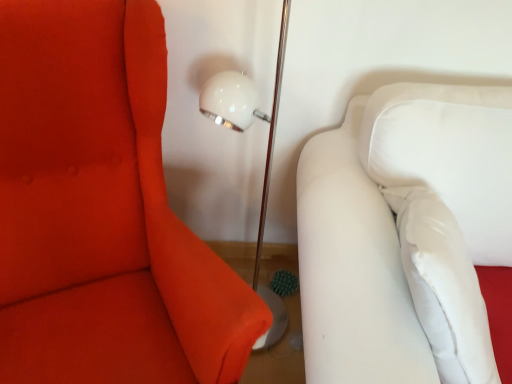
Image resolution: width=512 pixels, height=384 pixels. I want to click on matte white sofa at right, arranged as the second furniture when viewed from the right, so tap(102, 211).

Describe the element at coordinates (102, 211) in the screenshot. I see `matte white sofa at right, arranged as the second furniture when viewed from the right` at that location.

Where is `white fabric couch at right, the first furniture viewed from the right`? This screenshot has width=512, height=384. white fabric couch at right, the first furniture viewed from the right is located at coordinates pos(405,235).

This screenshot has width=512, height=384. Describe the element at coordinates (405, 235) in the screenshot. I see `white fabric couch at right, marked as the second furniture in a left-to-right arrangement` at that location.

Measure the distance between white fabric couch at right, marked as the second furniture in a left-to-right arrangement, and camera.

The depth of white fabric couch at right, marked as the second furniture in a left-to-right arrangement, is 28.08 inches.

At what (x,y) coordinates should I click in order to perform the action: click on matte white sofa at right, positioned as the first furniture in left-to-right order. Please return your answer as a coordinate pair (x, y). The image size is (512, 384). Looking at the image, I should click on (102, 211).

Is matte white sofa at right, positioned as the first furniture in left-to-right order, to the right of white fabric couch at right, marked as the second furniture in a left-to-right arrangement, from the viewer's perspective?

Incorrect, matte white sofa at right, positioned as the first furniture in left-to-right order, is not on the right side of white fabric couch at right, marked as the second furniture in a left-to-right arrangement.

Which object is more forward, matte white sofa at right, arranged as the second furniture when viewed from the right, or white fabric couch at right, the first furniture viewed from the right?

Positioned in front is matte white sofa at right, arranged as the second furniture when viewed from the right.

Which point is more forward, (184, 238) or (338, 185)?

The point (184, 238) is closer.

From the image's perspective, which one is positioned higher, matte white sofa at right, arranged as the second furniture when viewed from the right, or white fabric couch at right, marked as the second furniture in a left-to-right arrangement?

matte white sofa at right, arranged as the second furniture when viewed from the right.

Based on the photo, from a real-world perspective, is matte white sofa at right, positioned as the first furniture in left-to-right order, above or below white fabric couch at right, the first furniture viewed from the right?

In terms of real-world spatial position, matte white sofa at right, positioned as the first furniture in left-to-right order, is above white fabric couch at right, the first furniture viewed from the right.

Does matte white sofa at right, arranged as the second furniture when viewed from the right, have a lesser width compared to white fabric couch at right, the first furniture viewed from the right?

No, matte white sofa at right, arranged as the second furniture when viewed from the right, is not thinner than white fabric couch at right, the first furniture viewed from the right.

Who is shorter, matte white sofa at right, positioned as the first furniture in left-to-right order, or white fabric couch at right, the first furniture viewed from the right?

white fabric couch at right, the first furniture viewed from the right, is shorter.

Looking at the image, does matte white sofa at right, arranged as the second furniture when viewed from the right, seem bigger or smaller compared to white fabric couch at right, the first furniture viewed from the right?

matte white sofa at right, arranged as the second furniture when viewed from the right, is smaller than white fabric couch at right, the first furniture viewed from the right.

Is matte white sofa at right, positioned as the first furniture in left-to-right order, surrounding white fabric couch at right, marked as the second furniture in a left-to-right arrangement?

No, white fabric couch at right, marked as the second furniture in a left-to-right arrangement, is not inside matte white sofa at right, positioned as the first furniture in left-to-right order.

Are matte white sofa at right, positioned as the first furniture in left-to-right order, and white fabric couch at right, the first furniture viewed from the right, making contact?

They are not placed beside each other.

Is matte white sofa at right, arranged as the second furniture when viewed from the right, facing towards white fabric couch at right, marked as the second furniture in a left-to-right arrangement?

No, matte white sofa at right, arranged as the second furniture when viewed from the right, is not aimed at white fabric couch at right, marked as the second furniture in a left-to-right arrangement.

This screenshot has height=384, width=512. Find the location of `furniture located above the white fabric couch at right, the first furniture viewed from the right (from a real-world perspective)`. furniture located above the white fabric couch at right, the first furniture viewed from the right (from a real-world perspective) is located at coordinates (102, 211).

Is white fabric couch at right, marked as the second furniture in a left-to-right arrangement, to the right of matte white sofa at right, arranged as the second furniture when viewed from the right, from the viewer's perspective?

Indeed, white fabric couch at right, marked as the second furniture in a left-to-right arrangement, is positioned on the right side of matte white sofa at right, arranged as the second furniture when viewed from the right.

Which is behind, white fabric couch at right, marked as the second furniture in a left-to-right arrangement, or matte white sofa at right, arranged as the second furniture when viewed from the right?

white fabric couch at right, marked as the second furniture in a left-to-right arrangement, is more distant.

Does point (362, 258) lie in front of point (104, 216)?

That is True.

From the image's perspective, is white fabric couch at right, marked as the second furniture in a left-to-right arrangement, over matte white sofa at right, positioned as the first furniture in left-to-right order?

Incorrect, from the image's perspective, white fabric couch at right, marked as the second furniture in a left-to-right arrangement, is lower than matte white sofa at right, positioned as the first furniture in left-to-right order.

Consider the image. From a real-world perspective, between white fabric couch at right, the first furniture viewed from the right, and matte white sofa at right, arranged as the second furniture when viewed from the right, who is vertically higher?

From a 3D spatial view, matte white sofa at right, arranged as the second furniture when viewed from the right, is above.

Can you confirm if white fabric couch at right, the first furniture viewed from the right, is thinner than matte white sofa at right, positioned as the first furniture in left-to-right order?

Indeed, white fabric couch at right, the first furniture viewed from the right, has a lesser width compared to matte white sofa at right, positioned as the first furniture in left-to-right order.

Can you confirm if white fabric couch at right, marked as the second furniture in a left-to-right arrangement, is shorter than matte white sofa at right, positioned as the first furniture in left-to-right order?

Yes.

Considering the relative sizes of white fabric couch at right, marked as the second furniture in a left-to-right arrangement, and matte white sofa at right, arranged as the second furniture when viewed from the right, in the image provided, is white fabric couch at right, marked as the second furniture in a left-to-right arrangement, smaller than matte white sofa at right, arranged as the second furniture when viewed from the right,?

No.

Can matte white sofa at right, arranged as the second furniture when viewed from the right, be found inside white fabric couch at right, marked as the second furniture in a left-to-right arrangement?

No, matte white sofa at right, arranged as the second furniture when viewed from the right, is not a part of white fabric couch at right, marked as the second furniture in a left-to-right arrangement.

Is the surface of white fabric couch at right, marked as the second furniture in a left-to-right arrangement, in direct contact with matte white sofa at right, arranged as the second furniture when viewed from the right?

No, white fabric couch at right, marked as the second furniture in a left-to-right arrangement, is not making contact with matte white sofa at right, arranged as the second furniture when viewed from the right.

Is white fabric couch at right, marked as the second furniture in a left-to-right arrangement, positioned with its back to matte white sofa at right, arranged as the second furniture when viewed from the right?

No, white fabric couch at right, marked as the second furniture in a left-to-right arrangement, is not facing the opposite direction of matte white sofa at right, arranged as the second furniture when viewed from the right.

Can you tell me how much white fabric couch at right, the first furniture viewed from the right, and matte white sofa at right, arranged as the second furniture when viewed from the right, differ in facing direction?

white fabric couch at right, the first furniture viewed from the right, and matte white sofa at right, arranged as the second furniture when viewed from the right, are facing 27.6 degrees away from each other.

How much distance is there between white fabric couch at right, the first furniture viewed from the right, and matte white sofa at right, positioned as the first furniture in left-to-right order?

white fabric couch at right, the first furniture viewed from the right, is 17.52 inches away from matte white sofa at right, positioned as the first furniture in left-to-right order.

At what (x,y) coordinates should I click in order to perform the action: click on furniture below the matte white sofa at right, positioned as the first furniture in left-to-right order (from the image's perspective). Please return your answer as a coordinate pair (x, y). The height and width of the screenshot is (384, 512). Looking at the image, I should click on (405, 235).

Identify the location of furniture in front of the white fabric couch at right, the first furniture viewed from the right. This screenshot has width=512, height=384. (102, 211).

This screenshot has height=384, width=512. Find the location of `furniture behind the matte white sofa at right, arranged as the second furniture when viewed from the right`. furniture behind the matte white sofa at right, arranged as the second furniture when viewed from the right is located at coordinates (405, 235).